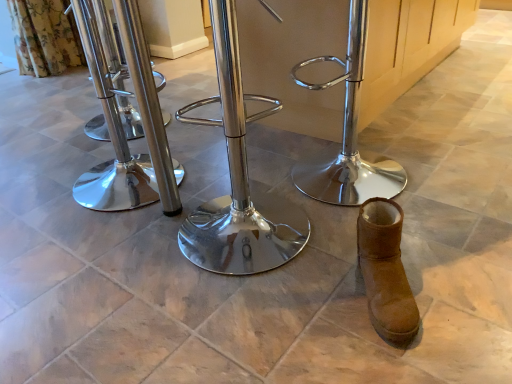
Question: Which direction should I rotate to face polished metal swivel chair at center, which appears as the 3th swivel chair when viewed from the left, — up or down?

Choices:
 (A) down
 (B) up

Answer: (B)

Question: Can you confirm if polished metal swivel chair at center, positioned as the 1th swivel chair in right-to-left order, is positioned to the left of polished metal swivel chair at center, marked as the 3th swivel chair in a right-to-left arrangement?

Choices:
 (A) yes
 (B) no

Answer: (B)

Question: Is polished metal swivel chair at center, positioned as the 1th swivel chair in right-to-left order, aimed at polished metal swivel chair at center, marked as the 3th swivel chair in a right-to-left arrangement?

Choices:
 (A) no
 (B) yes

Answer: (B)

Question: Considering the relative sizes of polished metal swivel chair at center, which appears as the 3th swivel chair when viewed from the left, and polished metal swivel chair at center, marked as the 3th swivel chair in a right-to-left arrangement, in the image provided, is polished metal swivel chair at center, which appears as the 3th swivel chair when viewed from the left, taller than polished metal swivel chair at center, marked as the 3th swivel chair in a right-to-left arrangement,?

Choices:
 (A) yes
 (B) no

Answer: (B)

Question: Is polished metal swivel chair at center, positioned as the 1th swivel chair in right-to-left order, positioned before polished metal swivel chair at center, marked as the 3th swivel chair in a right-to-left arrangement?

Choices:
 (A) no
 (B) yes

Answer: (B)

Question: Can you confirm if polished metal swivel chair at center, which appears as the 3th swivel chair when viewed from the left, is positioned to the right of polished metal swivel chair at center, marked as the 3th swivel chair in a right-to-left arrangement?

Choices:
 (A) no
 (B) yes

Answer: (B)

Question: From the image's perspective, does polished metal swivel chair at center, positioned as the 1th swivel chair in right-to-left order, appear lower than polished metal swivel chair at center, marked as the first swivel chair in a left-to-right arrangement?

Choices:
 (A) no
 (B) yes

Answer: (B)

Question: Does polished metal swivel chair at center, which appears as the 3th swivel chair when viewed from the left, appear on the right side of polished metal swivel chair at center, which is the second swivel chair from right to left?

Choices:
 (A) yes
 (B) no

Answer: (A)

Question: Does polished metal swivel chair at center, positioned as the 1th swivel chair in right-to-left order, lie in front of polished metal swivel chair at center, which appears as the 2th swivel chair when viewed from the left?

Choices:
 (A) no
 (B) yes

Answer: (A)

Question: Does polished metal swivel chair at center, positioned as the 1th swivel chair in right-to-left order, lie behind polished metal swivel chair at center, which appears as the 2th swivel chair when viewed from the left?

Choices:
 (A) yes
 (B) no

Answer: (A)

Question: Can you confirm if polished metal swivel chair at center, positioned as the 1th swivel chair in right-to-left order, is bigger than polished metal swivel chair at center, which appears as the 2th swivel chair when viewed from the left?

Choices:
 (A) yes
 (B) no

Answer: (B)

Question: Does polished metal swivel chair at center, positioned as the 1th swivel chair in right-to-left order, have a lesser width compared to polished metal swivel chair at center, which is the second swivel chair from right to left?

Choices:
 (A) yes
 (B) no

Answer: (B)

Question: Is polished metal swivel chair at center, which appears as the 3th swivel chair when viewed from the left, outside of polished metal swivel chair at center, which is the second swivel chair from right to left?

Choices:
 (A) no
 (B) yes

Answer: (B)

Question: Would you say polished metal swivel chair at center, which appears as the 2th swivel chair when viewed from the left, is part of brown suede boot at lower right's contents?

Choices:
 (A) yes
 (B) no

Answer: (B)